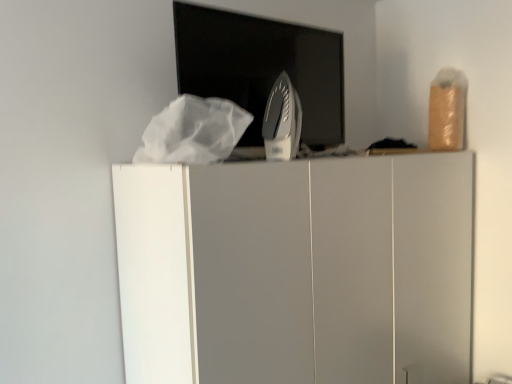
Question: Is metallic iron at center wider or thinner than white matte cabinet at center?

Choices:
 (A) wide
 (B) thin

Answer: (B)

Question: From a real-world perspective, relative to white matte cabinet at center, is metallic iron at center vertically above or below?

Choices:
 (A) below
 (B) above

Answer: (B)

Question: Based on their relative distances, which object is farther from the white matte cabinet at center?

Choices:
 (A) metallic iron at center
 (B) silver metallic iron at center

Answer: (B)

Question: Based on their relative distances, which object is nearer to the silver metallic iron at center?

Choices:
 (A) metallic iron at center
 (B) white matte cabinet at center

Answer: (A)